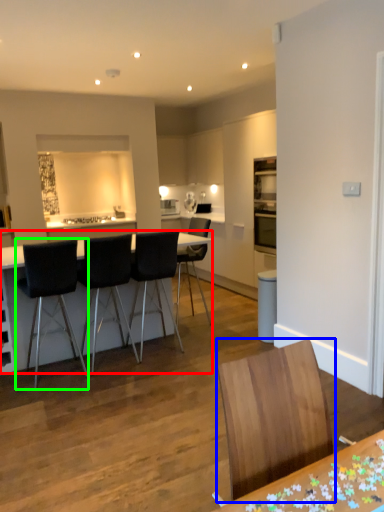
Question: Which object is the farthest from table (highlighted by a red box)? Choose among these: chair (highlighted by a blue box) or chair (highlighted by a green box).

Choices:
 (A) chair
 (B) chair

Answer: (A)